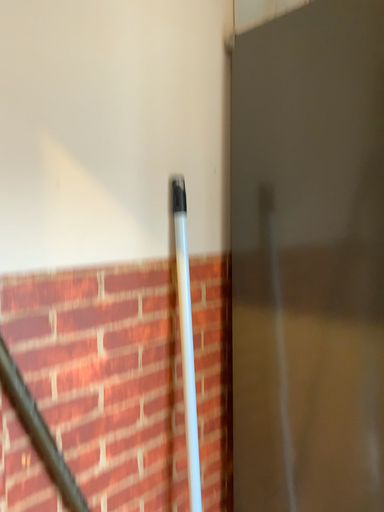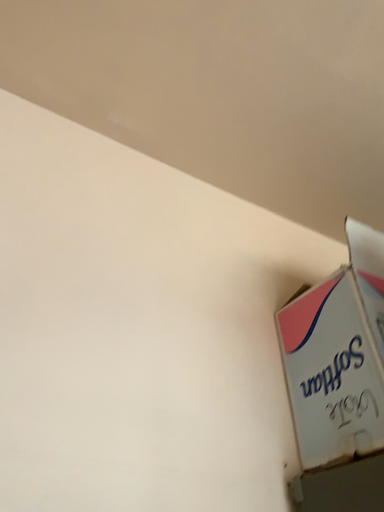
Question: Which way did the camera rotate in the video?

Choices:
 (A) rotated left
 (B) rotated right

Answer: (A)